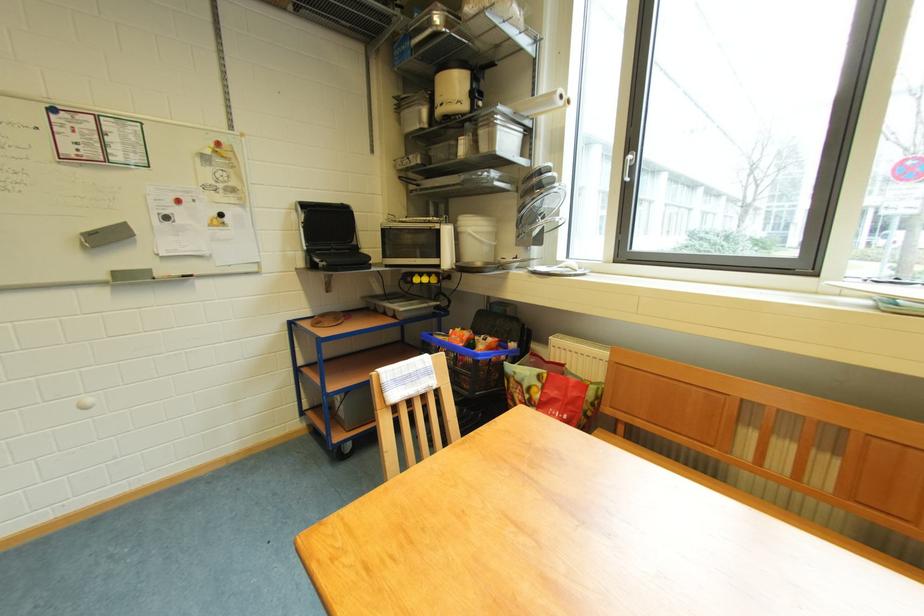
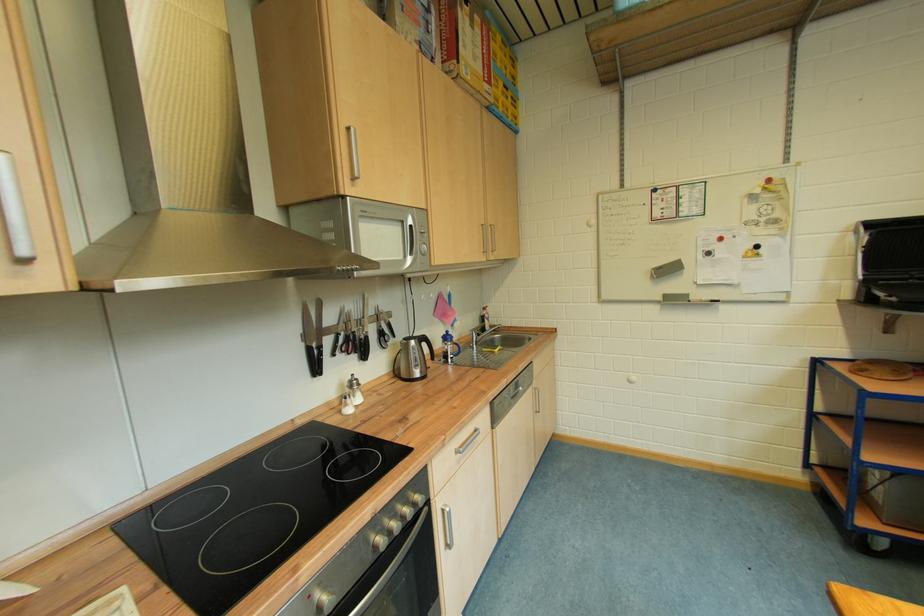
Question: Based on the continuous images, in which direction is the camera rotating? Reply with the corresponding letter.

Choices:
 (A) Left
 (B) Right
 (C) Up
 (D) Down

Answer: (A)